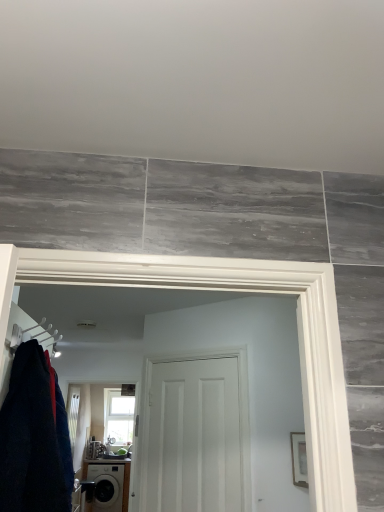
Question: Is clear glass window at upper center to the left of white plastic hanger at left from the viewer's perspective?

Choices:
 (A) no
 (B) yes

Answer: (B)

Question: Could you tell me if clear glass window at upper center is facing white plastic hanger at left?

Choices:
 (A) yes
 (B) no

Answer: (A)

Question: Is white plastic hanger at left at the back of clear glass window at upper center?

Choices:
 (A) no
 (B) yes

Answer: (A)

Question: Is clear glass window at upper center closer to the viewer compared to white plastic hanger at left?

Choices:
 (A) yes
 (B) no

Answer: (B)

Question: Considering the relative sizes of clear glass window at upper center and white plastic hanger at left in the image provided, is clear glass window at upper center taller than white plastic hanger at left?

Choices:
 (A) no
 (B) yes

Answer: (B)

Question: In terms of width, does white matte door at center look wider or thinner when compared to matte black washing machine at lower left?

Choices:
 (A) thin
 (B) wide

Answer: (A)

Question: Does point (165, 426) appear closer or farther from the camera than point (119, 493)?

Choices:
 (A) farther
 (B) closer

Answer: (B)

Question: Based on their positions, is white matte door at center located to the left or right of matte black washing machine at lower left?

Choices:
 (A) left
 (B) right

Answer: (B)

Question: From the image's perspective, relative to matte black washing machine at lower left, is white matte door at center above or below?

Choices:
 (A) above
 (B) below

Answer: (A)

Question: Is white plastic hanger at left to the left or to the right of matte black washing machine at lower left in the image?

Choices:
 (A) right
 (B) left

Answer: (A)

Question: From the image's perspective, is white plastic hanger at left located above or below matte black washing machine at lower left?

Choices:
 (A) above
 (B) below

Answer: (A)

Question: Is white plastic hanger at left inside or outside of matte black washing machine at lower left?

Choices:
 (A) inside
 (B) outside

Answer: (B)

Question: Looking at their shapes, would you say white plastic hanger at left is wider or thinner than matte black washing machine at lower left?

Choices:
 (A) wide
 (B) thin

Answer: (B)

Question: In the image, is matte black washing machine at lower left on the left side or the right side of clear glass window at upper center?

Choices:
 (A) right
 (B) left

Answer: (B)

Question: Looking at their shapes, would you say matte black washing machine at lower left is wider or thinner than clear glass window at upper center?

Choices:
 (A) thin
 (B) wide

Answer: (B)